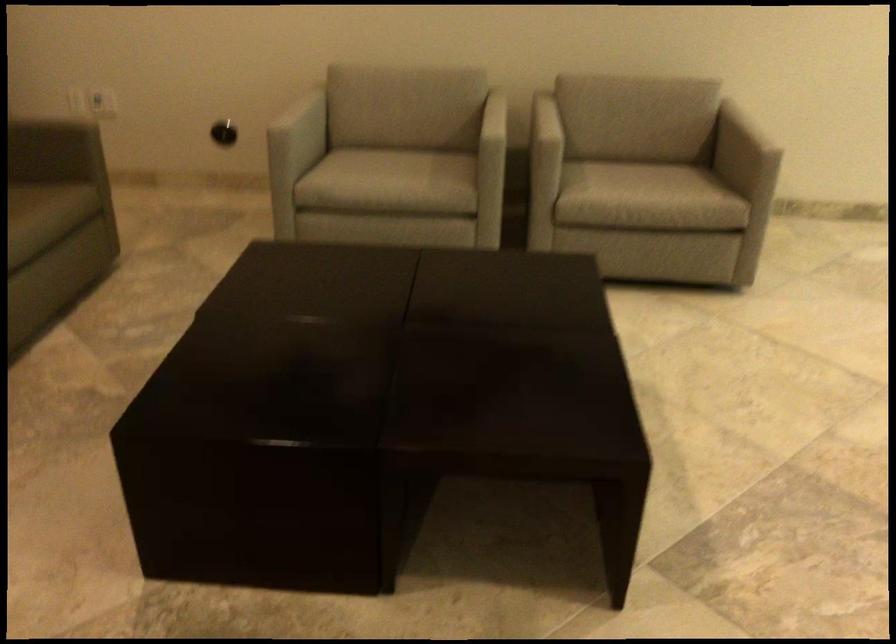
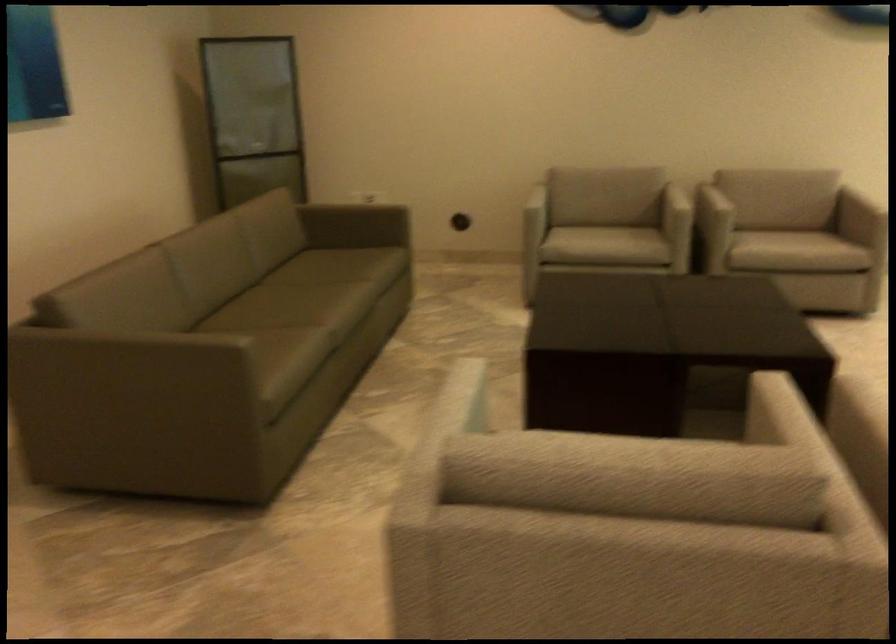
Find the pixel in the second image that matches pixel 545 140 in the first image.

(719, 205)